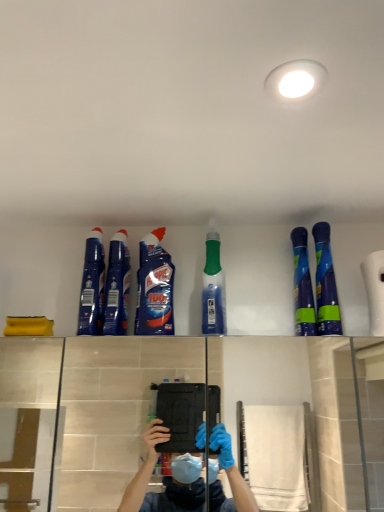
The image size is (384, 512). What do you see at coordinates (92, 286) in the screenshot?
I see `blue glossy cleaner at upper left, the 6th cleaning product when ordered from right to left` at bounding box center [92, 286].

The width and height of the screenshot is (384, 512). I want to click on blue glossy spray bottles at upper right, marked as the second cleaning product in a right-to-left arrangement, so click(x=302, y=285).

This screenshot has width=384, height=512. Identify the location of blue glossy bottle at upper center, which ranks as the fourth cleaning product in right-to-left order. (154, 287).

The width and height of the screenshot is (384, 512). Identify the location of blue glossy cleaner at upper left, the 6th cleaning product when ordered from right to left. (92, 286).

Considering their positions, is blue glossy spray bottle at upper right, positioned as the first cleaning product in right-to-left order, located in front of or behind blue glossy spray bottles at upper right, the fifth cleaning product from the left?

Clearly, blue glossy spray bottle at upper right, positioned as the first cleaning product in right-to-left order, is in front of blue glossy spray bottles at upper right, the fifth cleaning product from the left.

Considering the points (330, 258) and (306, 281), which point is behind, point (330, 258) or point (306, 281)?

Point (330, 258)

Looking at this image, does blue glossy spray bottle at upper right, positioned as the first cleaning product in right-to-left order, have a greater height compared to blue glossy spray bottles at upper right, marked as the second cleaning product in a right-to-left arrangement?

No.

Are blue glossy spray bottle at upper right, which is counted as the 6th cleaning product, starting from the left, and blue glossy bottle at upper center, which is the 3th cleaning product from left to right, located far from each other?

No, there isn't a large distance between blue glossy spray bottle at upper right, which is counted as the 6th cleaning product, starting from the left, and blue glossy bottle at upper center, which is the 3th cleaning product from left to right.

Can you confirm if blue glossy spray bottle at upper right, which is counted as the 6th cleaning product, starting from the left, is thinner than blue glossy bottle at upper center, which is the 3th cleaning product from left to right?

No.

From the image's perspective, which is below, blue glossy spray bottle at upper right, which is counted as the 6th cleaning product, starting from the left, or blue glossy bottle at upper center, which ranks as the fourth cleaning product in right-to-left order?

blue glossy bottle at upper center, which ranks as the fourth cleaning product in right-to-left order.

What's the angular difference between blue glossy spray bottles at upper right, the fifth cleaning product from the left, and green translucent bottle at center, which is counted as the third cleaning product, starting from the right,'s facing directions?

There is a 4.94-degree angle between the facing directions of blue glossy spray bottles at upper right, the fifth cleaning product from the left, and green translucent bottle at center, which is counted as the third cleaning product, starting from the right.

Is blue glossy spray bottles at upper right, the fifth cleaning product from the left, to the left of green translucent bottle at center, which is counted as the third cleaning product, starting from the right, from the viewer's perspective?

Incorrect, blue glossy spray bottles at upper right, the fifth cleaning product from the left, is not on the left side of green translucent bottle at center, which is counted as the third cleaning product, starting from the right.

How much distance is there between blue glossy spray bottles at upper right, marked as the second cleaning product in a right-to-left arrangement, and green translucent bottle at center, which is counted as the third cleaning product, starting from the right?

blue glossy spray bottles at upper right, marked as the second cleaning product in a right-to-left arrangement, and green translucent bottle at center, which is counted as the third cleaning product, starting from the right, are 8.03 inches apart from each other.

From the image's perspective, which is above, blue glossy spray bottles at upper right, the fifth cleaning product from the left, or green translucent bottle at center, marked as the fourth cleaning product in a left-to-right arrangement?

green translucent bottle at center, marked as the fourth cleaning product in a left-to-right arrangement, from the image's perspective.

From the image's perspective, is blue glossy cleaner at center, acting as the second cleaning product starting from the left, under blue glossy bottle at upper center, which is the 3th cleaning product from left to right?

No, from the image's perspective, blue glossy cleaner at center, acting as the second cleaning product starting from the left, is not beneath blue glossy bottle at upper center, which is the 3th cleaning product from left to right.

Can we say blue glossy cleaner at center, which appears as the fifth cleaning product when viewed from the right, lies outside blue glossy bottle at upper center, which is the 3th cleaning product from left to right?

That's correct, blue glossy cleaner at center, which appears as the fifth cleaning product when viewed from the right, is outside of blue glossy bottle at upper center, which is the 3th cleaning product from left to right.

From a real-world perspective, which object stands above the other?

In real-world perspective, blue glossy cleaner at center, which appears as the fifth cleaning product when viewed from the right, is above.

From a real-world perspective, count 1st cleaning products downward from the blue glossy cleaner at center, which appears as the fifth cleaning product when viewed from the right, and point to it. Please provide its 2D coordinates.

[(154, 287)]

Can you confirm if green translucent bottle at center, which is counted as the third cleaning product, starting from the right, is positioned to the left of blue glossy spray bottle at upper right, which is counted as the 6th cleaning product, starting from the left?

Yes.

Find the location of a particular element. This screenshot has width=384, height=512. cleaning product that is the 3rd one above the blue glossy spray bottle at upper right, positioned as the first cleaning product in right-to-left order (from a real-world perspective) is located at coordinates coord(213,289).

In the scene shown: Who is bigger, green translucent bottle at center, marked as the fourth cleaning product in a left-to-right arrangement, or blue glossy spray bottle at upper right, which is counted as the 6th cleaning product, starting from the left?

green translucent bottle at center, marked as the fourth cleaning product in a left-to-right arrangement, is bigger.

Which object is wider, green translucent bottle at center, marked as the fourth cleaning product in a left-to-right arrangement, or blue glossy spray bottle at upper right, which is counted as the 6th cleaning product, starting from the left?

With larger width is green translucent bottle at center, marked as the fourth cleaning product in a left-to-right arrangement.

Can you confirm if blue glossy spray bottle at upper right, which is counted as the 6th cleaning product, starting from the left, is positioned to the right of blue glossy cleaner at center, which appears as the fifth cleaning product when viewed from the right?

Yes, blue glossy spray bottle at upper right, which is counted as the 6th cleaning product, starting from the left, is to the right of blue glossy cleaner at center, which appears as the fifth cleaning product when viewed from the right.

Is blue glossy spray bottle at upper right, which is counted as the 6th cleaning product, starting from the left, turned away from blue glossy cleaner at center, acting as the second cleaning product starting from the left?

No, blue glossy spray bottle at upper right, which is counted as the 6th cleaning product, starting from the left, is not facing away from blue glossy cleaner at center, acting as the second cleaning product starting from the left.

Is blue glossy spray bottle at upper right, positioned as the first cleaning product in right-to-left order, closer to the viewer compared to blue glossy cleaner at center, which appears as the fifth cleaning product when viewed from the right?

Yes, it is.

What's the angular difference between blue glossy spray bottles at upper right, the fifth cleaning product from the left, and blue glossy cleaner at center, which appears as the fifth cleaning product when viewed from the right,'s facing directions?

They differ by 7.82 degrees in their facing directions.

Can you confirm if blue glossy spray bottles at upper right, marked as the second cleaning product in a right-to-left arrangement, is positioned to the left of blue glossy cleaner at center, acting as the second cleaning product starting from the left?

No, blue glossy spray bottles at upper right, marked as the second cleaning product in a right-to-left arrangement, is not to the left of blue glossy cleaner at center, acting as the second cleaning product starting from the left.

Does point (299, 269) lie behind point (119, 232)?

No, it is not.

Is blue glossy spray bottles at upper right, marked as the second cleaning product in a right-to-left arrangement, not close to blue glossy cleaner at center, which appears as the fifth cleaning product when viewed from the right?

They are positioned close to each other.

From the image's perspective, starting from the blue glossy spray bottle at upper right, which is counted as the 6th cleaning product, starting from the left, which cleaning product is the 4th one below? Please provide its 2D coordinates.

[(302, 285)]

The image size is (384, 512). Identify the location of the 3rd cleaning product to the right of the blue glossy bottle at upper center, which ranks as the fourth cleaning product in right-to-left order, starting your count from the anchor. (325, 284).

In the scene shown: Which object lies nearer to the anchor point blue glossy cleaner at upper left, the 6th cleaning product when ordered from right to left, blue glossy bottle at upper center, which ranks as the fourth cleaning product in right-to-left order, or green translucent bottle at center, marked as the fourth cleaning product in a left-to-right arrangement?

blue glossy bottle at upper center, which ranks as the fourth cleaning product in right-to-left order.

When comparing their distances from blue glossy spray bottle at upper right, positioned as the first cleaning product in right-to-left order, does blue glossy cleaner at center, which appears as the fifth cleaning product when viewed from the right, or blue glossy bottle at upper center, which is the 3th cleaning product from left to right, seem further?

Among the two, blue glossy cleaner at center, which appears as the fifth cleaning product when viewed from the right, is located further to blue glossy spray bottle at upper right, positioned as the first cleaning product in right-to-left order.

Which object lies nearer to the anchor point green translucent bottle at center, marked as the fourth cleaning product in a left-to-right arrangement, blue glossy spray bottle at upper right, positioned as the first cleaning product in right-to-left order, or blue glossy spray bottles at upper right, marked as the second cleaning product in a right-to-left arrangement?

blue glossy spray bottles at upper right, marked as the second cleaning product in a right-to-left arrangement, is positioned closer to the anchor green translucent bottle at center, marked as the fourth cleaning product in a left-to-right arrangement.

Looking at the image, which one is located closer to blue glossy spray bottle at upper right, positioned as the first cleaning product in right-to-left order, blue glossy bottle at upper center, which is the 3th cleaning product from left to right, or blue glossy cleaner at center, which appears as the fifth cleaning product when viewed from the right?

Among the two, blue glossy bottle at upper center, which is the 3th cleaning product from left to right, is located nearer to blue glossy spray bottle at upper right, positioned as the first cleaning product in right-to-left order.

Considering their positions, is blue glossy cleaner at upper left, placed as the 1th cleaning product when sorted from left to right, positioned further to blue glossy spray bottle at upper right, which is counted as the 6th cleaning product, starting from the left, than blue glossy spray bottles at upper right, marked as the second cleaning product in a right-to-left arrangement?

The object further to blue glossy spray bottle at upper right, which is counted as the 6th cleaning product, starting from the left, is blue glossy cleaner at upper left, placed as the 1th cleaning product when sorted from left to right.

Looking at the image, which one is located closer to green translucent bottle at center, which is counted as the third cleaning product, starting from the right, blue glossy spray bottle at upper right, which is counted as the 6th cleaning product, starting from the left, or blue glossy cleaner at upper left, the 6th cleaning product when ordered from right to left?

blue glossy spray bottle at upper right, which is counted as the 6th cleaning product, starting from the left, is closer to green translucent bottle at center, which is counted as the third cleaning product, starting from the right.

When comparing their distances from blue glossy spray bottle at upper right, which is counted as the 6th cleaning product, starting from the left, does blue glossy cleaner at upper left, the 6th cleaning product when ordered from right to left, or blue glossy cleaner at center, which appears as the fifth cleaning product when viewed from the right, seem closer?

Among the two, blue glossy cleaner at center, which appears as the fifth cleaning product when viewed from the right, is located nearer to blue glossy spray bottle at upper right, which is counted as the 6th cleaning product, starting from the left.

Considering their positions, is blue glossy bottle at upper center, which is the 3th cleaning product from left to right, positioned closer to blue glossy spray bottles at upper right, marked as the second cleaning product in a right-to-left arrangement, than blue glossy cleaner at upper left, placed as the 1th cleaning product when sorted from left to right?

blue glossy bottle at upper center, which is the 3th cleaning product from left to right, lies closer to blue glossy spray bottles at upper right, marked as the second cleaning product in a right-to-left arrangement, than the other object.

Find the location of `cleaning product situated between blue glossy cleaner at center, which appears as the fifth cleaning product when viewed from the right, and green translucent bottle at center, which is counted as the third cleaning product, starting from the right, from left to right`. cleaning product situated between blue glossy cleaner at center, which appears as the fifth cleaning product when viewed from the right, and green translucent bottle at center, which is counted as the third cleaning product, starting from the right, from left to right is located at coordinates tap(154, 287).

Image resolution: width=384 pixels, height=512 pixels. In order to click on cleaning product between blue glossy cleaner at upper left, the 6th cleaning product when ordered from right to left, and blue glossy bottle at upper center, which is the 3th cleaning product from left to right in this screenshot , I will do `click(117, 286)`.

The width and height of the screenshot is (384, 512). Find the location of `cleaning product between green translucent bottle at center, marked as the fourth cleaning product in a left-to-right arrangement, and blue glossy spray bottle at upper right, positioned as the first cleaning product in right-to-left order, from left to right`. cleaning product between green translucent bottle at center, marked as the fourth cleaning product in a left-to-right arrangement, and blue glossy spray bottle at upper right, positioned as the first cleaning product in right-to-left order, from left to right is located at coordinates (302, 285).

Identify the location of cleaning product located between blue glossy bottle at upper center, which is the 3th cleaning product from left to right, and blue glossy spray bottles at upper right, the fifth cleaning product from the left, in the left-right direction. This screenshot has height=512, width=384. (213, 289).